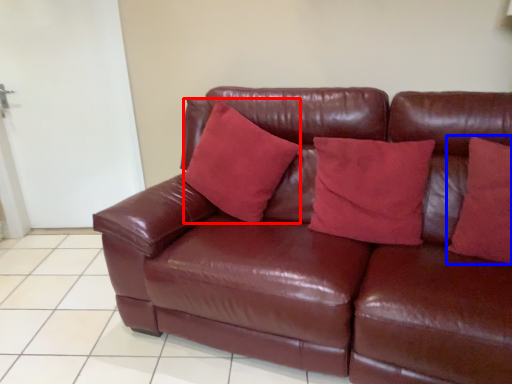
Question: Which object is further to the camera taking this photo, pillow (highlighted by a red box) or pillow (highlighted by a blue box)?

Choices:
 (A) pillow
 (B) pillow

Answer: (A)